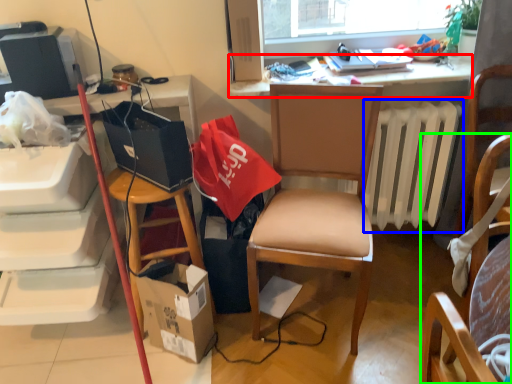
Question: Which is nearer to the desk (highlighted by a red box)? radiator (highlighted by a blue box) or chair (highlighted by a green box).

Choices:
 (A) radiator
 (B) chair

Answer: (A)